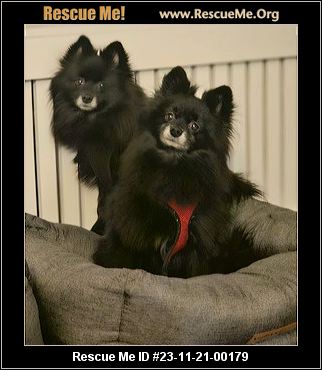
Find the location of a particular element. The height and width of the screenshot is (370, 322). dog bed is located at coordinates (120, 312).